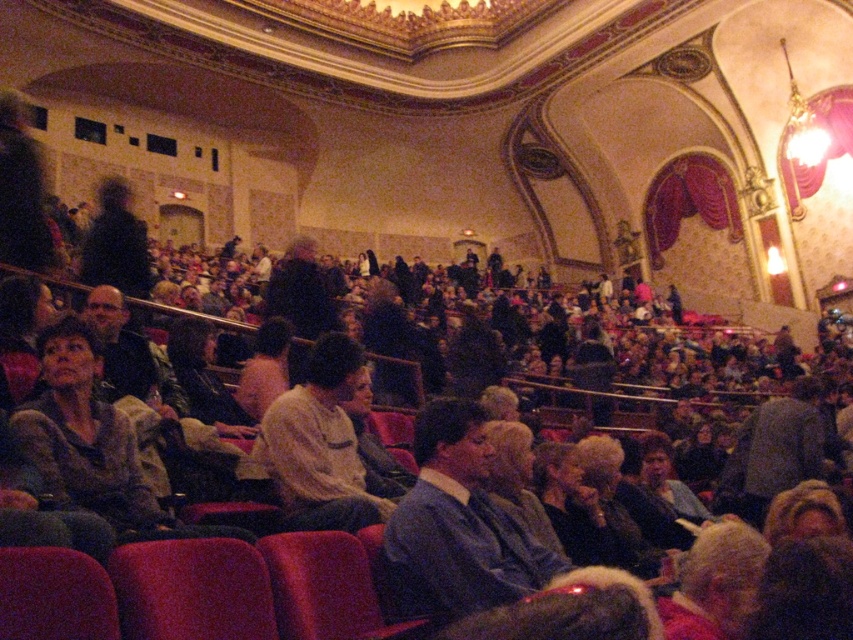
Question: Which of the following is the farthest from the observer?

Choices:
 (A) (337, 488)
 (B) (408, 504)

Answer: (A)

Question: Can you confirm if blue sweater at center is bigger than light beige shirt at center?

Choices:
 (A) no
 (B) yes

Answer: (B)

Question: Can you confirm if blue sweater at center is thinner than light beige shirt at center?

Choices:
 (A) no
 (B) yes

Answer: (A)

Question: Which of the following is the closest to the observer?

Choices:
 (A) blue sweater at center
 (B) light beige shirt at center

Answer: (A)

Question: Can you confirm if blue sweater at center is bigger than light beige shirt at center?

Choices:
 (A) no
 (B) yes

Answer: (B)